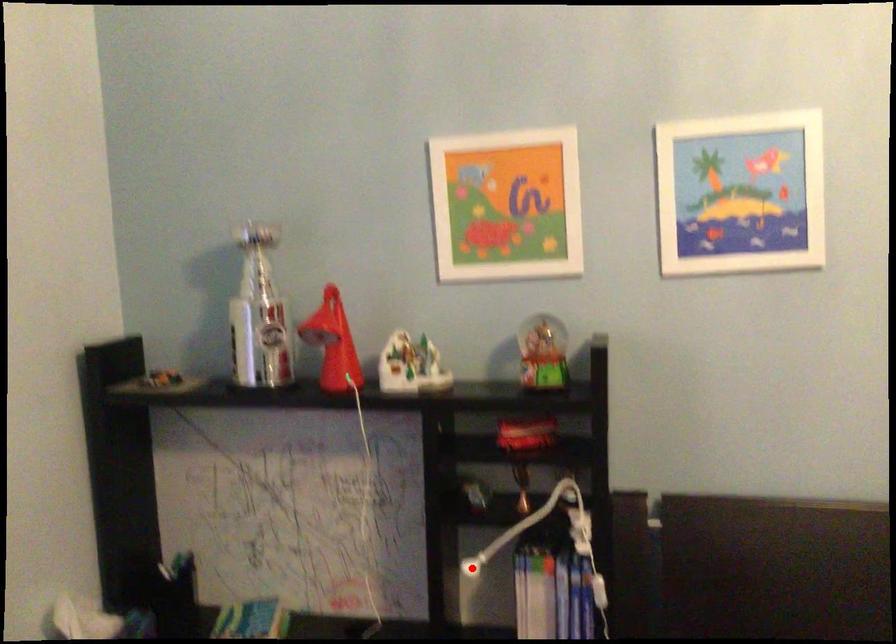
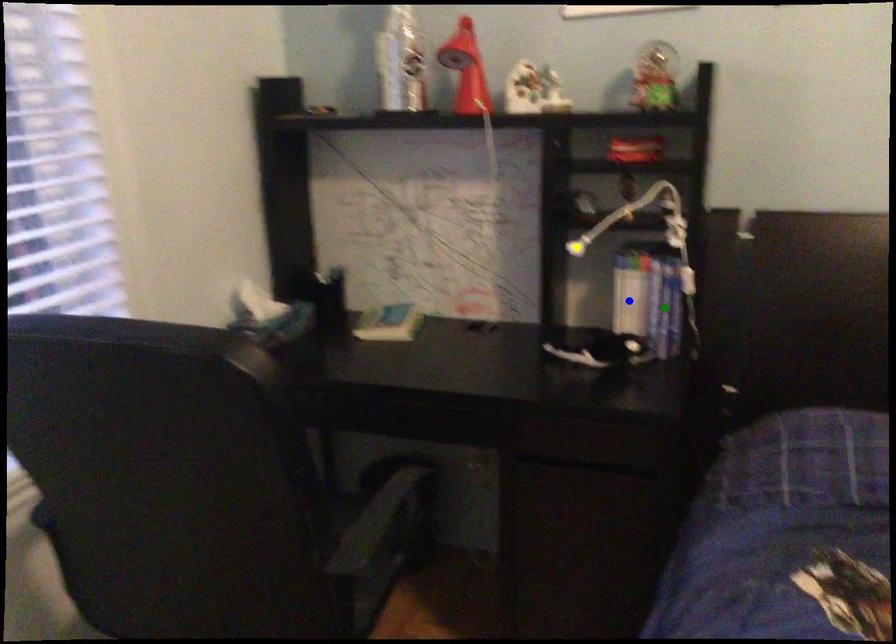
Question: I am providing you with two images of the same scene from different viewpoints. A red point is marked on the first image. You are given multiple points on the second image. Which point in image 2 is actually the same real-world point as the red point in image 1?

Choices:
 (A) yellow point
 (B) green point
 (C) blue point

Answer: (A)